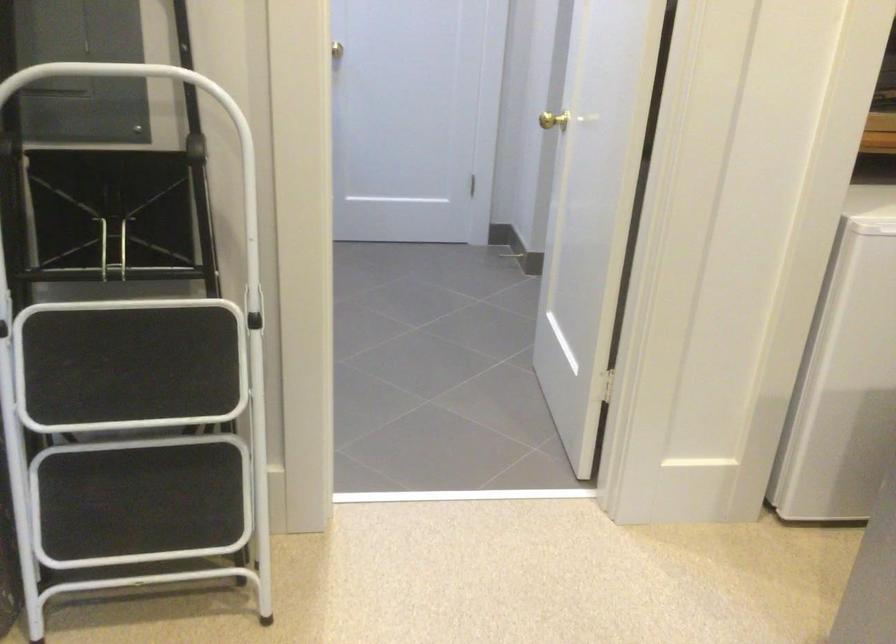
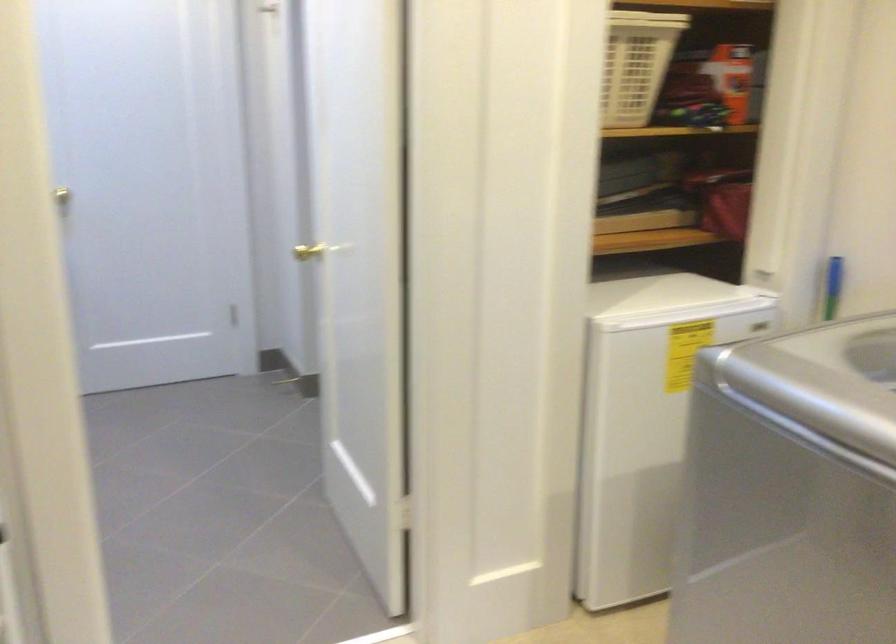
What movement of the cameraman would produce the second image?

The movement direction of the cameraman is left, forward.